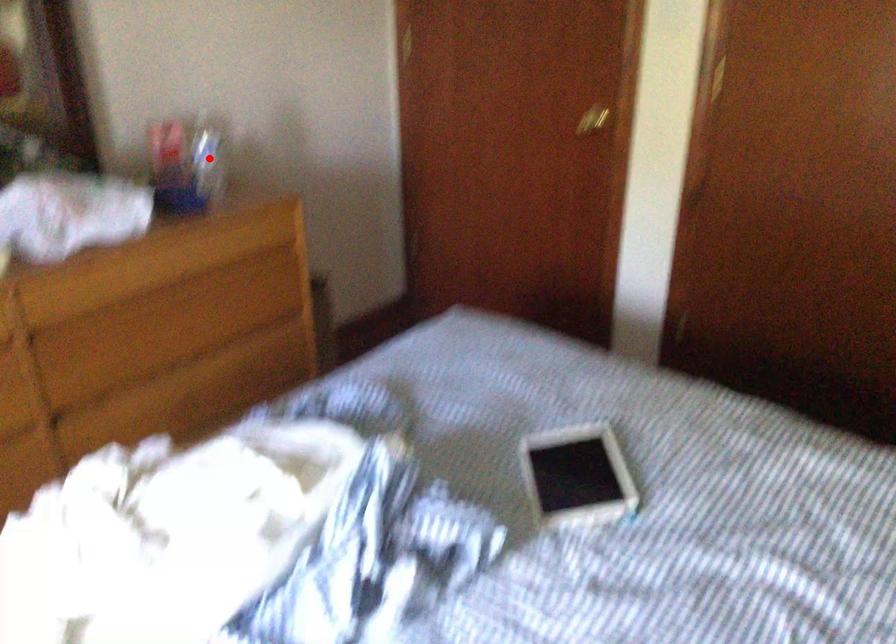
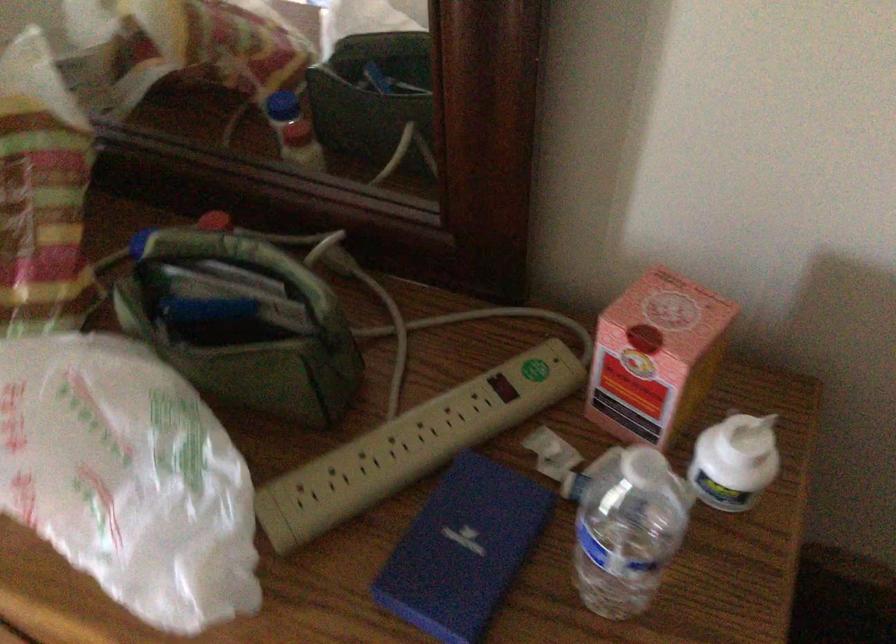
Question: A red point is marked in image1. In image2, is the corresponding 3D point closer to the camera or farther? Reply with the corresponding letter.

Choices:
 (A) The corresponding 3D point is closer.
 (B) The corresponding 3D point is farther.

Answer: (A)